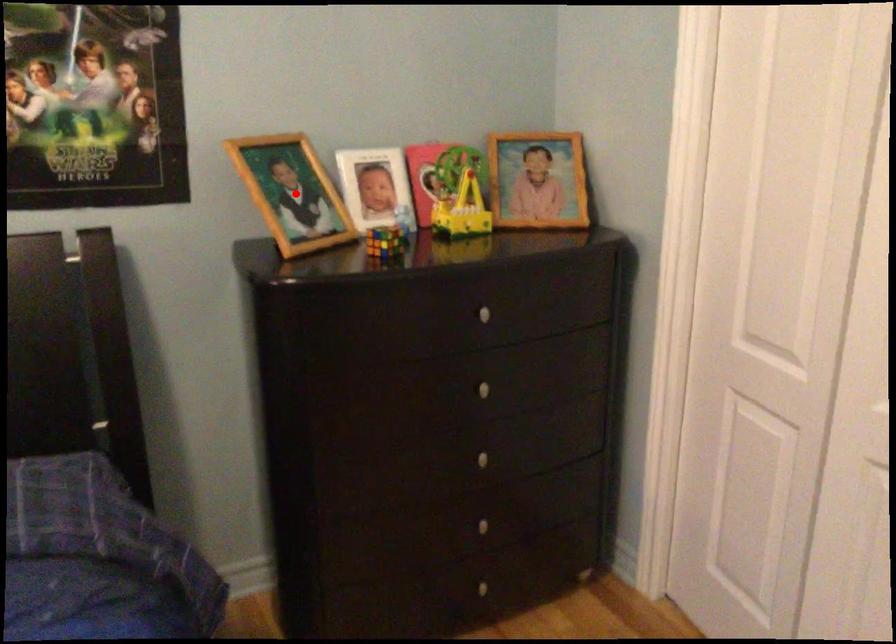
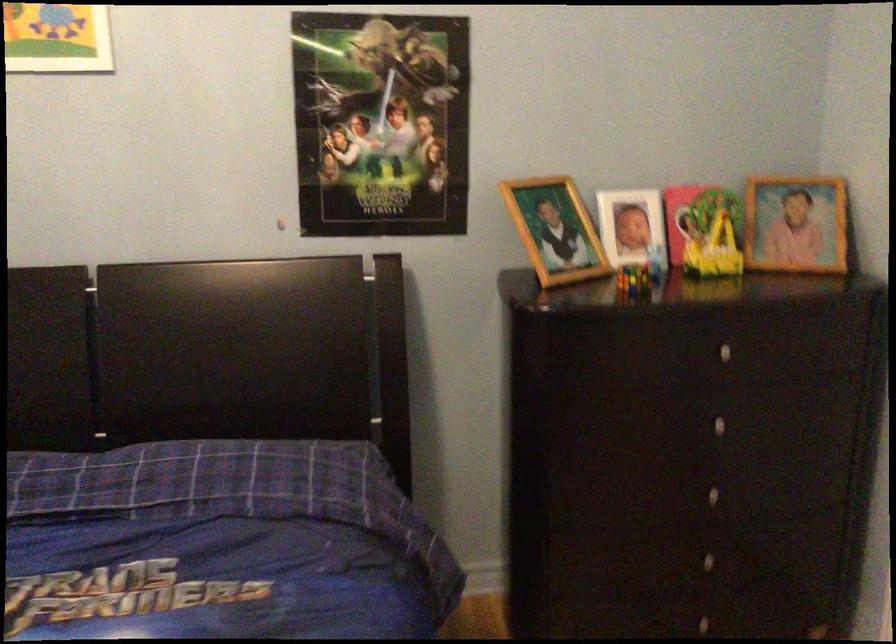
The point at the highlighted location is marked in the first image. Where is the corresponding point in the second image?

(555, 230)